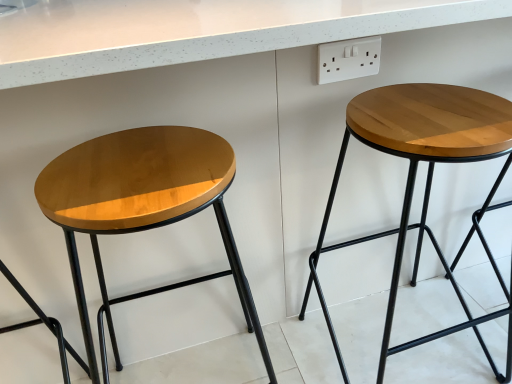
Identify the location of vacant point above wooden stool at right, which appears as the second stool when viewed from the left (from a real-world perspective). (429, 114).